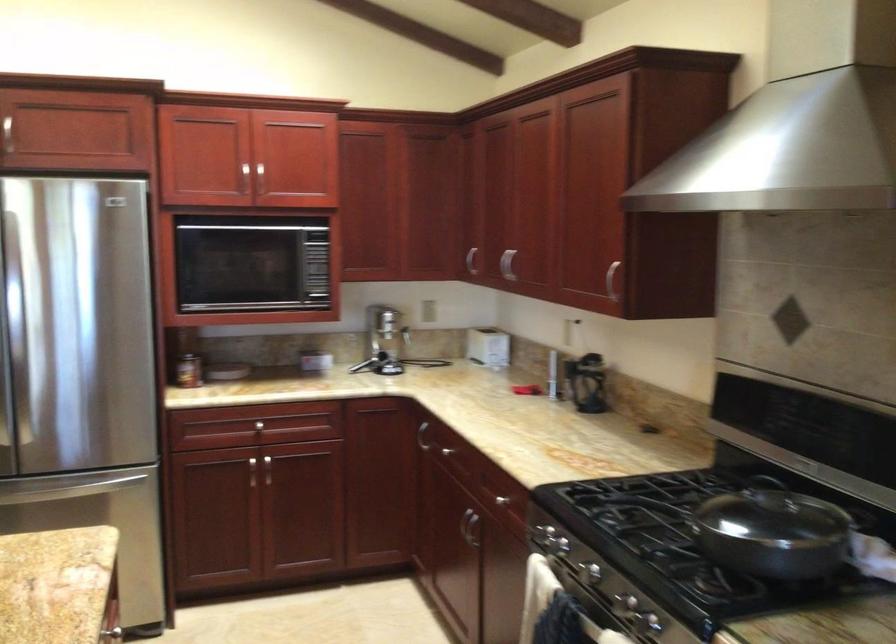
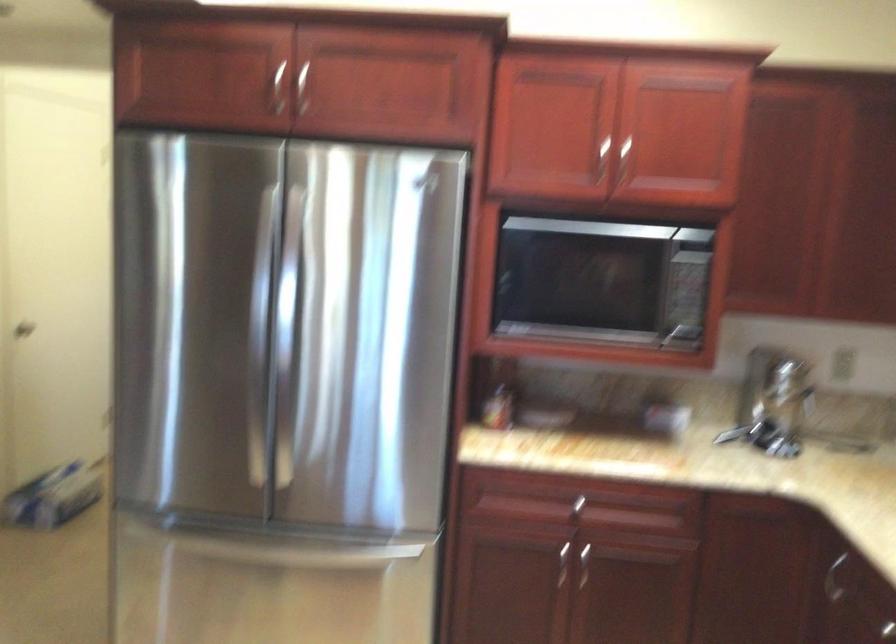
Question: The images are taken continuously from a first-person perspective. In which direction are you moving?

Choices:
 (A) Left
 (B) Right
 (C) Forward
 (D) Backward

Answer: (C)